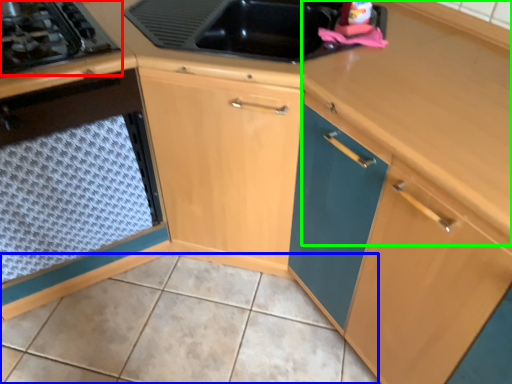
Question: Which object is positioned farthest from gas stove (highlighted by a red box)? Select from tile (highlighted by a blue box) and counter top (highlighted by a green box).

Choices:
 (A) tile
 (B) counter top

Answer: (A)